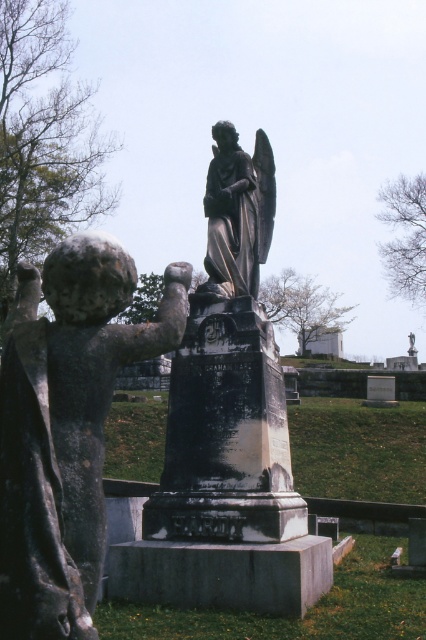
Can you confirm if black marble statue at center is positioned to the right of polished bronze angel at center?

Indeed, black marble statue at center is positioned on the right side of polished bronze angel at center.

Who is lower down, black marble statue at center or polished bronze angel at center?

black marble statue at center

Find the location of a particular element. The image size is (426, 640). black marble statue at center is located at coordinates (229, 376).

Is matte stone cherub at left to the left of polished bronze angel at center from the viewer's perspective?

Correct, you'll find matte stone cherub at left to the left of polished bronze angel at center.

Is matte stone cherub at left shorter than polished bronze angel at center?

Incorrect, matte stone cherub at left's height does not fall short of polished bronze angel at center's.

Between point (57, 554) and point (238, 256), which one is positioned in front?

Point (57, 554) is in front.

Locate an element on the screen. The image size is (426, 640). matte stone cherub at left is located at coordinates (66, 426).

Between point (71, 476) and point (278, 381), which one is positioned behind?

The point (278, 381) is more distant.

This screenshot has height=640, width=426. I want to click on matte stone cherub at left, so click(66, 426).